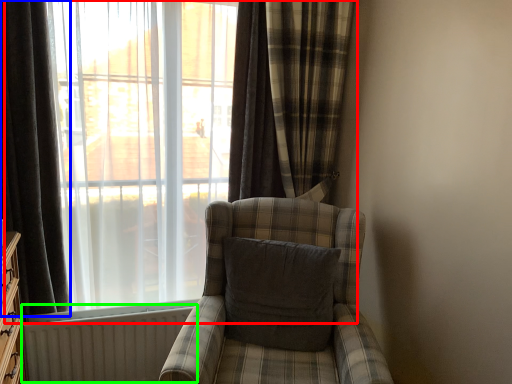
Question: Based on their relative distances, which object is farther from window (highlighted by a red box)? Choose from curtain (highlighted by a blue box) and radiator (highlighted by a green box).

Choices:
 (A) curtain
 (B) radiator

Answer: (B)